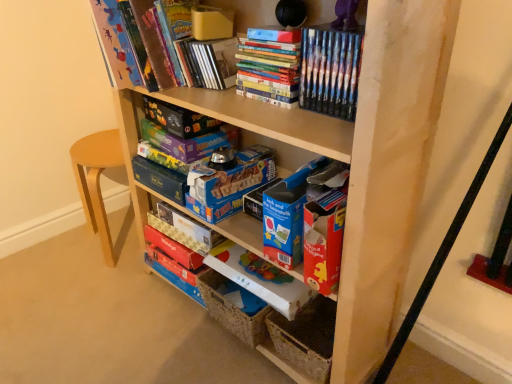
Question: Is hardcover books at upper center, the second book positioned from the left, in front of or behind matte purple board game at center, which is the third paperback book from top to bottom, in the image?

Choices:
 (A) front
 (B) behind

Answer: (A)

Question: Is point [273, 59] positioned closer to the camera than point [219, 140]?

Choices:
 (A) farther
 (B) closer

Answer: (B)

Question: Based on their relative distances, which object is nearer to the matte cardboard book at center, the 2th paperback book in the bottom-to-top sequence?

Choices:
 (A) matte board game at upper center, acting as the second paperback book starting from the top
 (B) hardcover book at upper center, which is the 2th book from right to left
 (C) hardcover books at upper center, the second book positioned from the left
 (D) wooden shelf at center
 (E) hardcover book at upper center, the 7th paperback book positioned from the bottom

Answer: (A)

Question: Considering the real-world distances, which object is farthest from the hardcover book at upper center, the 7th paperback book positioned from the bottom?

Choices:
 (A) hardcover books at upper center, which is the first book in right-to-left order
 (B) matte purple board game at center, the 4th paperback book from the bottom
 (C) wooden shelf at center
 (D) blue cardboard book at center, which ranks as the 1th paperback book in bottom-to-top order
 (E) matte cardboard book at center, the 2th paperback book in the bottom-to-top sequence

Answer: (E)